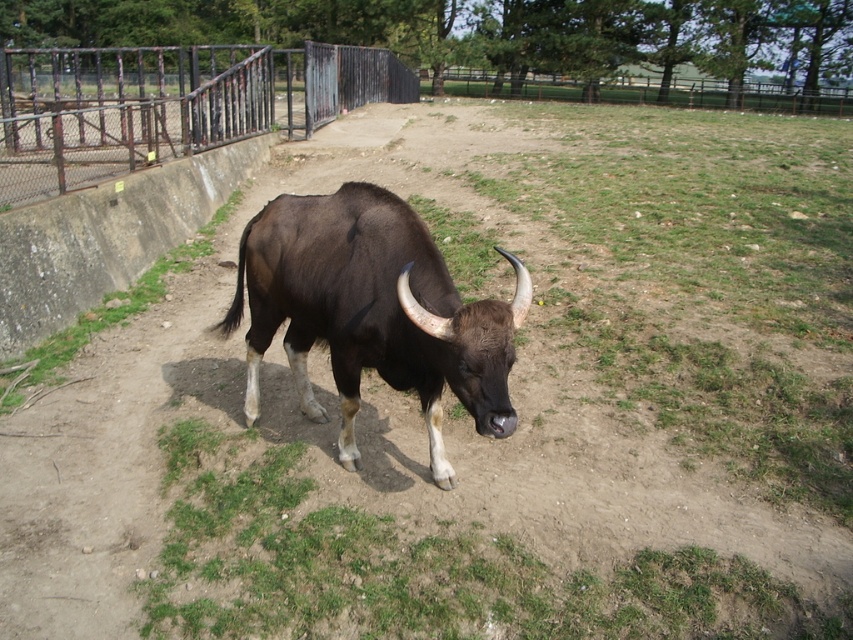
Question: Which object appears farthest from the camera in this image?

Choices:
 (A) rusty metal fence at upper center
 (B) brown glossy bull at center

Answer: (A)

Question: Can you confirm if brown glossy bull at center is thinner than rusty metal fence at upper center?

Choices:
 (A) no
 (B) yes

Answer: (B)

Question: Does brown glossy bull at center have a lesser width compared to rusty metal fence at upper center?

Choices:
 (A) yes
 (B) no

Answer: (A)

Question: Can you confirm if brown glossy bull at center is positioned below rusty metal fence at upper center?

Choices:
 (A) no
 (B) yes

Answer: (B)